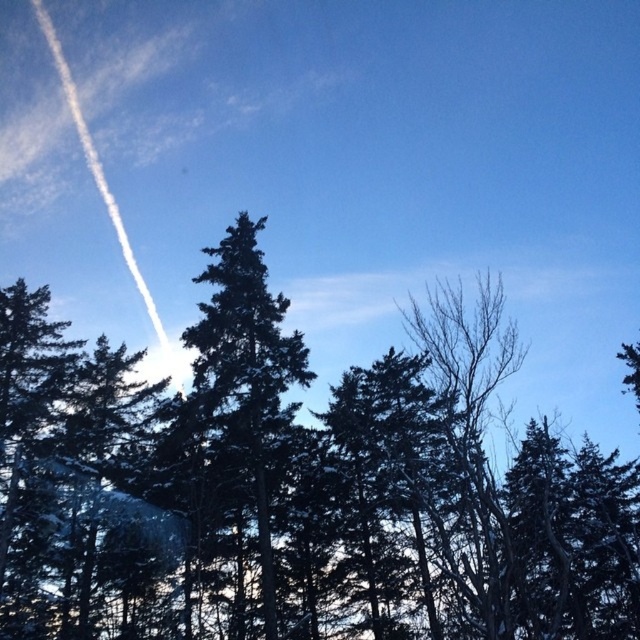
Question: Can you confirm if green needle-like trees at center is positioned to the left of green needle-like tree at center?

Choices:
 (A) no
 (B) yes

Answer: (A)

Question: Which of the following is the closest to the observer?

Choices:
 (A) (224, 403)
 (B) (568, 536)

Answer: (A)

Question: Which point is closer to the camera?

Choices:
 (A) (273, 381)
 (B) (340, 496)

Answer: (A)

Question: Observing the image, what is the correct spatial positioning of green needle-like trees at center in reference to green needle-like tree at center?

Choices:
 (A) right
 (B) left

Answer: (A)

Question: Is the position of green needle-like trees at center more distant than that of green needle-like tree at center?

Choices:
 (A) no
 (B) yes

Answer: (A)